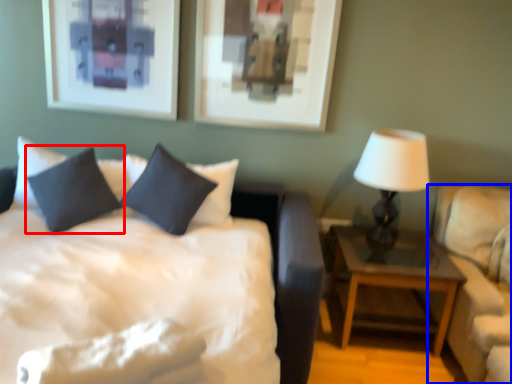
Question: Which object appears farthest to the camera in this image, pillow (highlighted by a red box) or studio couch (highlighted by a blue box)?

Choices:
 (A) pillow
 (B) studio couch

Answer: (A)